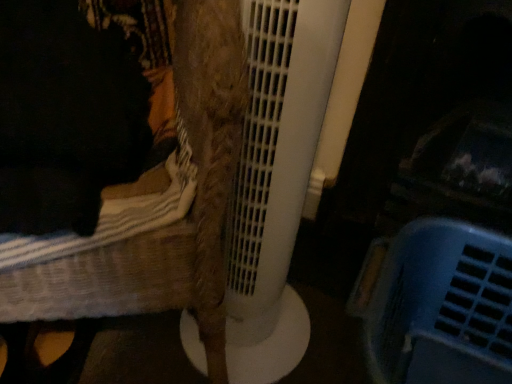
Question: Considering the relative sizes of blue plastic basket at lower right and woven fabric chair at left in the image provided, is blue plastic basket at lower right bigger than woven fabric chair at left?

Choices:
 (A) yes
 (B) no

Answer: (B)

Question: From the image's perspective, is blue plastic basket at lower right over woven fabric chair at left?

Choices:
 (A) yes
 (B) no

Answer: (B)

Question: Would you say blue plastic basket at lower right is outside woven fabric chair at left?

Choices:
 (A) yes
 (B) no

Answer: (A)

Question: Are blue plastic basket at lower right and woven fabric chair at left far apart?

Choices:
 (A) no
 (B) yes

Answer: (A)

Question: Could you tell me if blue plastic basket at lower right is facing woven fabric chair at left?

Choices:
 (A) no
 (B) yes

Answer: (A)

Question: Is blue plastic basket at lower right placed right next to woven fabric chair at left?

Choices:
 (A) yes
 (B) no

Answer: (B)

Question: Is blue plastic basket at lower right inside woven fabric chair at left?

Choices:
 (A) no
 (B) yes

Answer: (A)

Question: Is woven fabric chair at left positioned with its back to blue plastic basket at lower right?

Choices:
 (A) no
 (B) yes

Answer: (A)

Question: Considering the relative sizes of woven fabric chair at left and blue plastic basket at lower right in the image provided, is woven fabric chair at left wider than blue plastic basket at lower right?

Choices:
 (A) yes
 (B) no

Answer: (A)

Question: Can you confirm if woven fabric chair at left is thinner than blue plastic basket at lower right?

Choices:
 (A) yes
 (B) no

Answer: (B)

Question: Is woven fabric chair at left aimed at blue plastic basket at lower right?

Choices:
 (A) yes
 (B) no

Answer: (B)

Question: From the image's perspective, would you say woven fabric chair at left is shown under blue plastic basket at lower right?

Choices:
 (A) no
 (B) yes

Answer: (A)

Question: In the image, is blue plastic basket at lower right on the left side or the right side of woven fabric chair at left?

Choices:
 (A) right
 (B) left

Answer: (A)